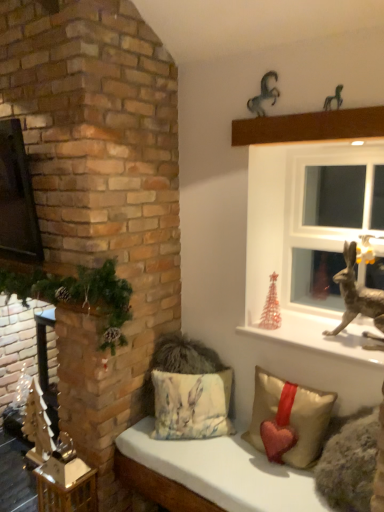
This screenshot has width=384, height=512. I want to click on free spot in front of white plastic window at upper right, so click(x=323, y=333).